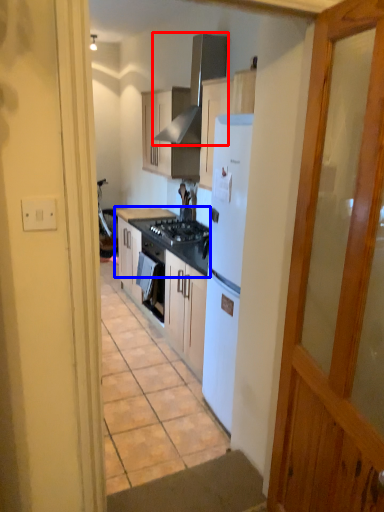
Question: Which object is further to the camera taking this photo, exhaust hood (highlighted by a red box) or countertop (highlighted by a blue box)?

Choices:
 (A) exhaust hood
 (B) countertop

Answer: (B)